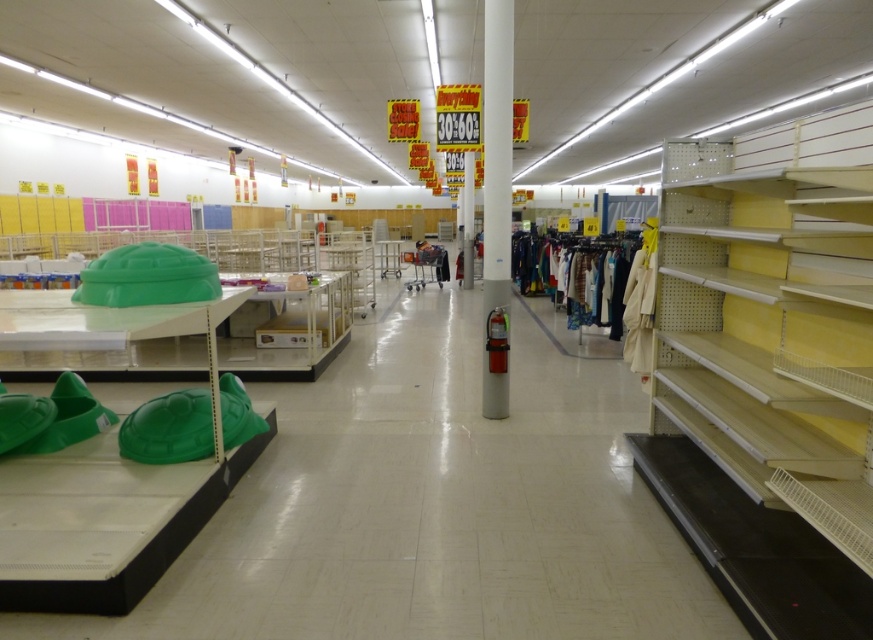
Is metallic yellow shelf at right to the left of white glossy fire extinguisher at center from the viewer's perspective?

No, metallic yellow shelf at right is not to the left of white glossy fire extinguisher at center.

Does metallic yellow shelf at right have a lesser height compared to white glossy fire extinguisher at center?

Indeed, metallic yellow shelf at right has a lesser height compared to white glossy fire extinguisher at center.

Does point (803, 580) lie in front of point (509, 132)?

Yes, point (803, 580) is in front of point (509, 132).

You are a GUI agent. You are given a task and a screenshot of the screen. Output one action in this format:
    pyautogui.click(x=<x>, y=<y>)
    Task: Click on the metallic yellow shelf at right
    
    Given the screenshot: What is the action you would take?
    pyautogui.click(x=768, y=371)